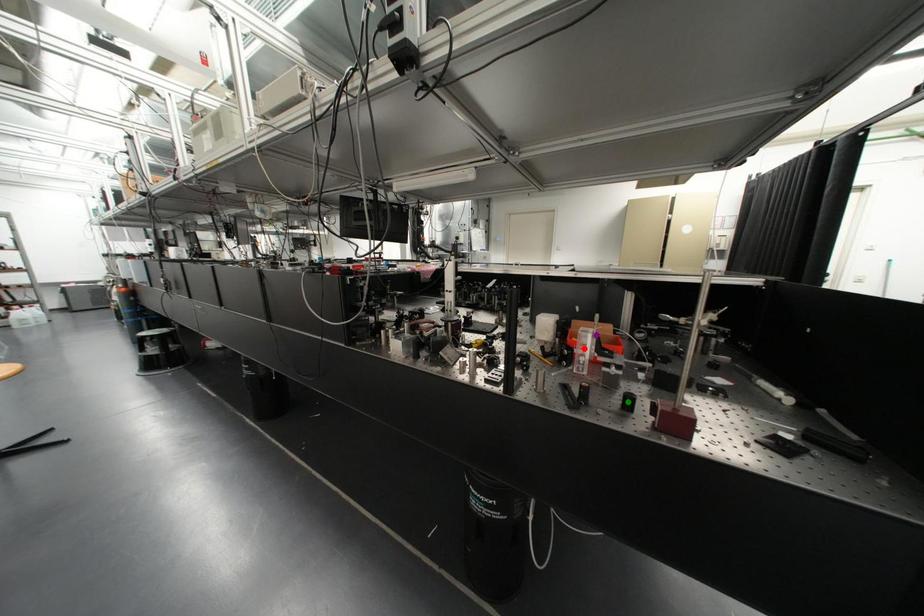
Order these from farthest to nearest:
green point, red point, purple point

purple point
red point
green point